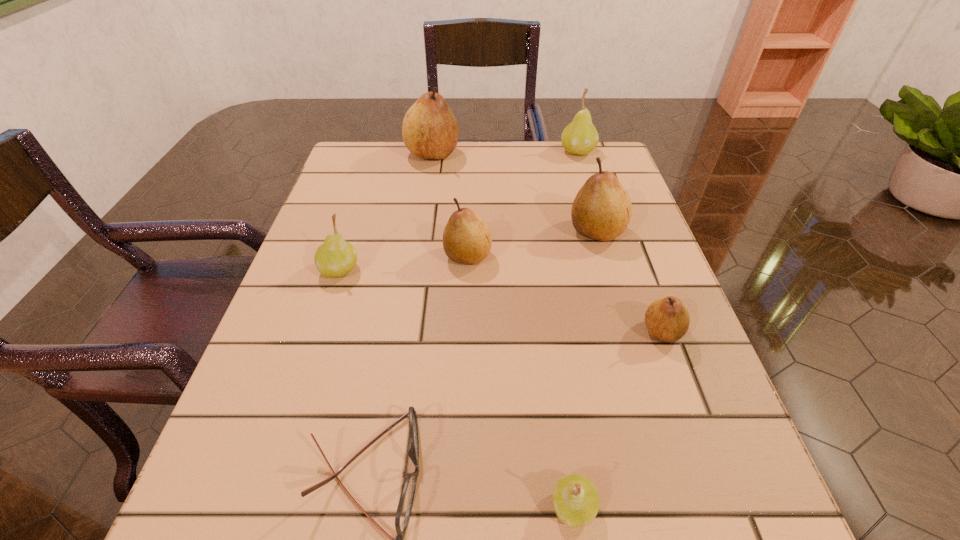
You are a GUI agent. You are given a task and a screenshot of the screen. Output one action in this format:
    pyautogui.click(x=<x>, y=<y>)
    Task: Click on the farthest brown pear
    The image size is (960, 540).
    Given the screenshot: What is the action you would take?
    pyautogui.click(x=430, y=130)

Find the location of a particular element. the tallest object is located at coordinates (430, 130).

I want to click on the rightmost green pear, so click(580, 137).

Locate an element on the screen. Image resolution: width=960 pixels, height=540 pixels. the farthest green pear is located at coordinates (580, 137).

The image size is (960, 540). Find the location of `the second biggest brown pear`. the second biggest brown pear is located at coordinates (602, 209).

Find the location of a particular element. The width and height of the screenshot is (960, 540). the leftmost object is located at coordinates (335, 257).

I want to click on the second smallest green pear, so click(335, 257).

Identify the location of the second smallest brown pear. The width and height of the screenshot is (960, 540). point(467,239).

Locate an element on the screen. The height and width of the screenshot is (540, 960). the nearest brown pear is located at coordinates (667, 319).

Identify the location of the third nearest object. tap(667, 319).